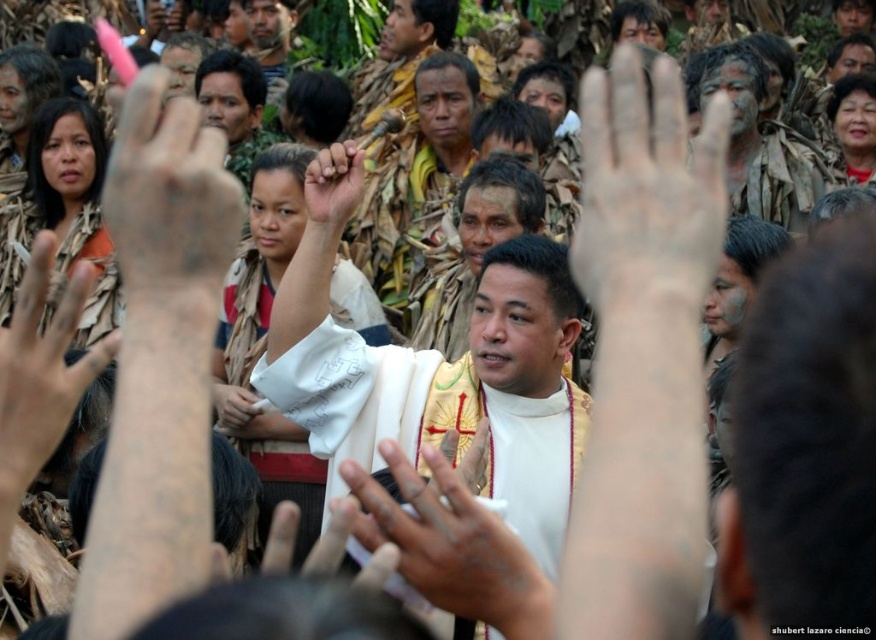
Question: Which object is the farthest from the brown leather hand at center?

Choices:
 (A) pink matte hand at upper left
 (B) dirty face paint at center
 (C) dry skin palm at center

Answer: (B)

Question: Can you confirm if dry skin palm at center is thinner than brown textured hand at left?

Choices:
 (A) no
 (B) yes

Answer: (B)

Question: Is white matte hand at center positioned in front of brown textured hand at left?

Choices:
 (A) no
 (B) yes

Answer: (A)

Question: Based on their relative distances, which object is nearer to the brown textured hand at left?

Choices:
 (A) dirty face paint at center
 (B) dry skin palm at center
 (C) brown leather hand at center

Answer: (C)

Question: Does dry skin palm at center have a larger size compared to smooth white cloth at center?

Choices:
 (A) yes
 (B) no

Answer: (A)

Question: Which is farther from the white clothed man at center?

Choices:
 (A) dirty face paint at center
 (B) white matte hand at center
 (C) brown leather hand at center

Answer: (A)